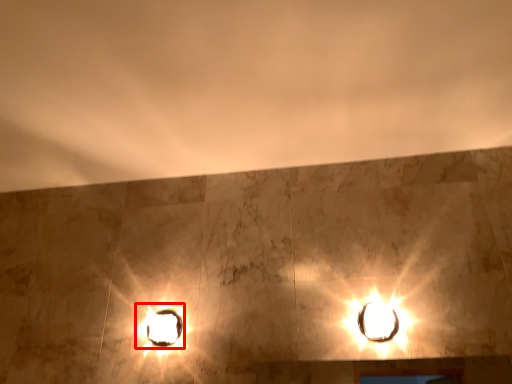
Question: From the image's perspective, considering the relative positions of stage light (annotated by the red box) and lamp in the image provided, where is stage light (annotated by the red box) located with respect to the staircase?

Choices:
 (A) above
 (B) below

Answer: (B)